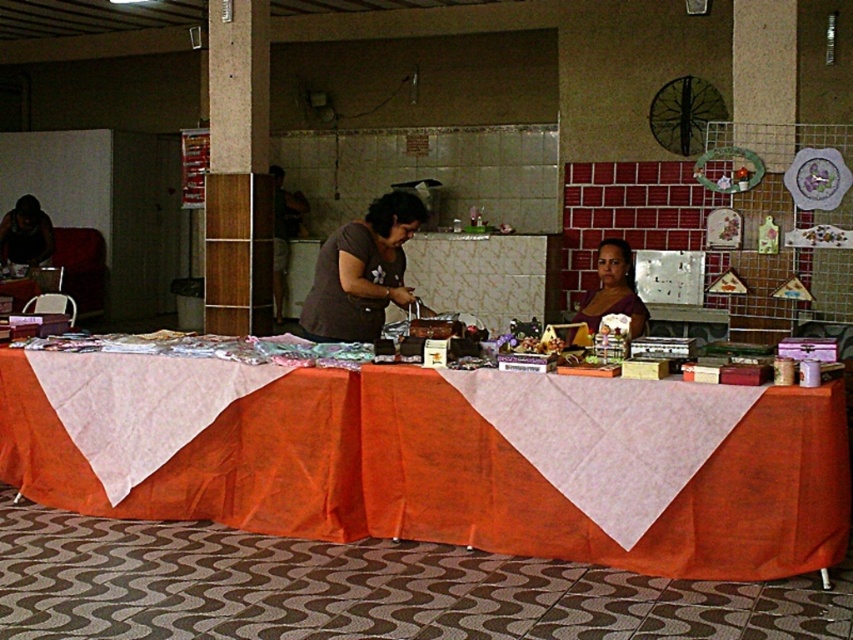
You are a customer at the craft sale and want to pick up the matte brown dress at center. However, there is an orange fabric table at center in your way. Can you reach the dress without moving the table?

The orange fabric table at center is located below the matte brown dress at center, so the dress is above the table. You can reach the matte brown dress at center by simply reaching over the orange fabric table at center without needing to move it.

You are standing at the entrance of the market and see the matte brown dress at center and the matte black laptop at left. You want to pick up the laptop first and then the dress. Which item should you go to first and why?

You should go to the matte black laptop at left first because it is closer to you than the matte brown dress at center, which is 6.50 meters away.

You are setting up a table for a craft sale and have two fabrics to choose from. The orange fabric table at center and the dark gray fabric at center. Which fabric covers more horizontal space on the table?

The orange fabric table at center has a greater width than the dark gray fabric at center, so it covers more horizontal space on the table.